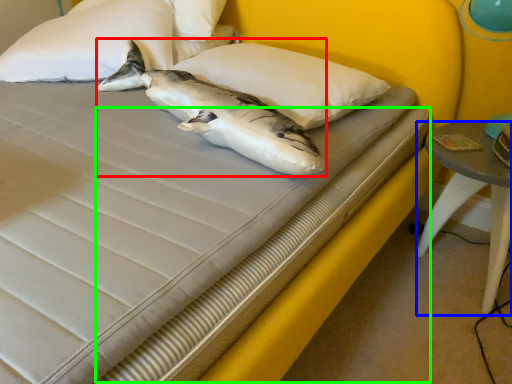
Question: Considering the real-world distances, which object is farthest from shark (highlighted by a red box)? table (highlighted by a blue box) or bed frame (highlighted by a green box)?

Choices:
 (A) table
 (B) bed frame

Answer: (A)